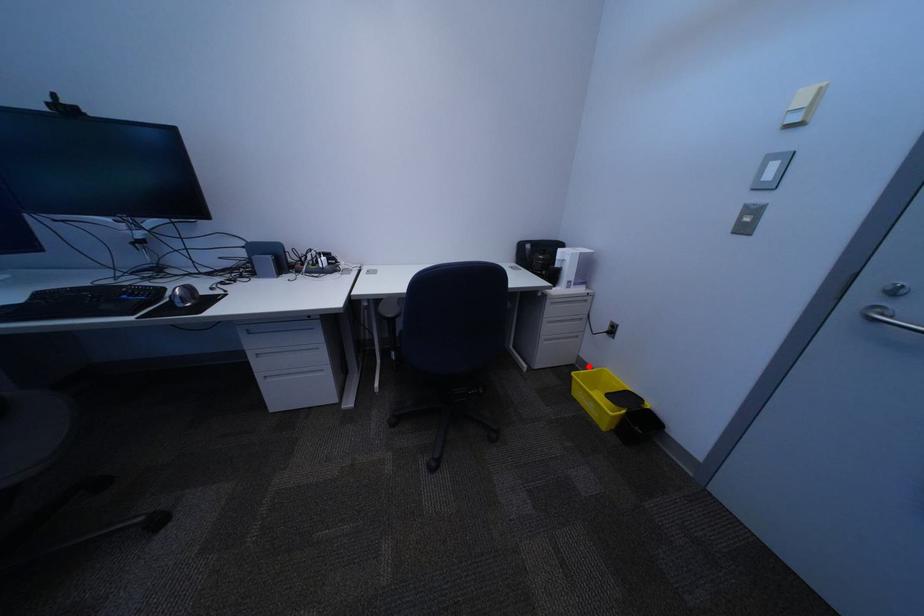
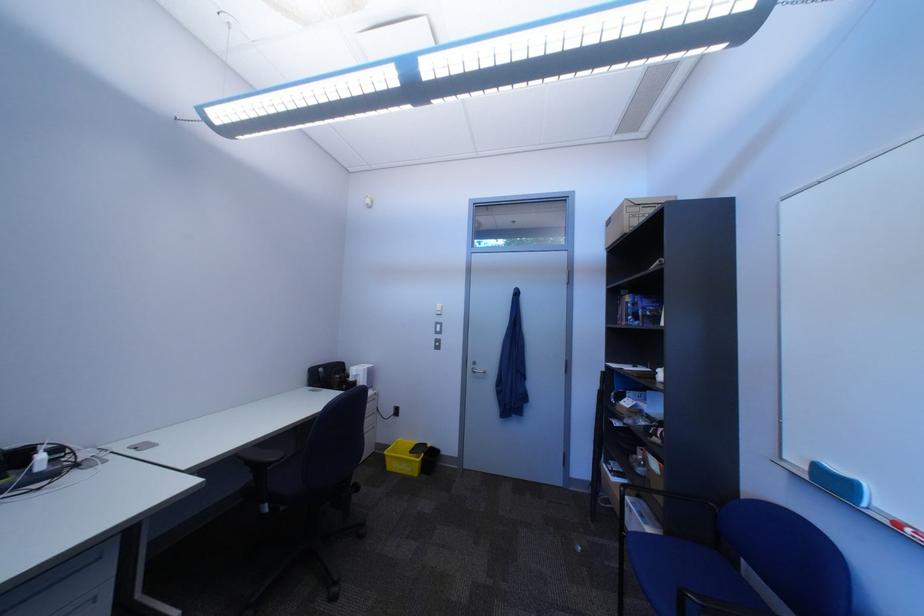
Question: I am providing you with two images of the same scene from different viewpoints. Given a red point in image1, look at the same physical point in image2. Is it:

Choices:
 (A) Closer to the viewpoint
 (B) Farther from the viewpoint

Answer: (B)